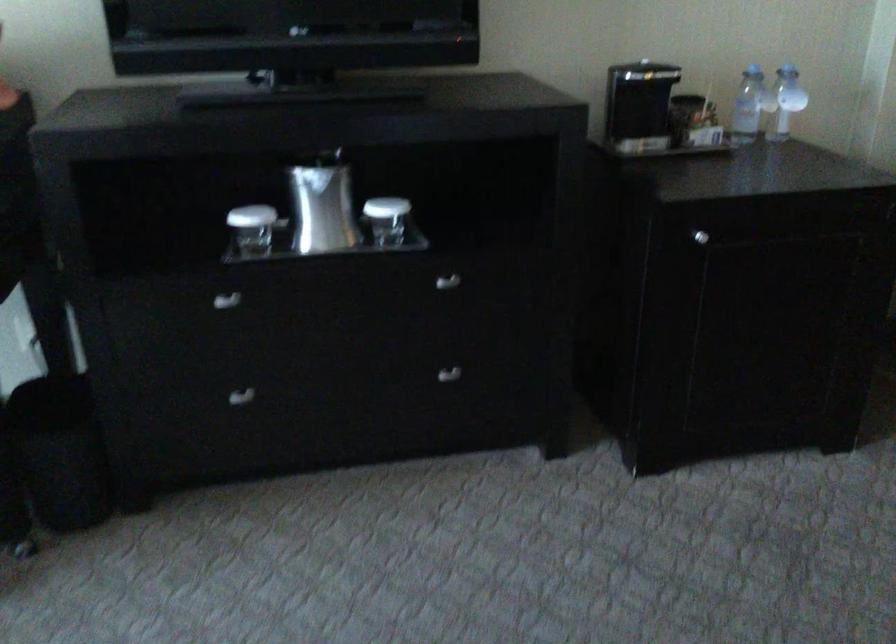
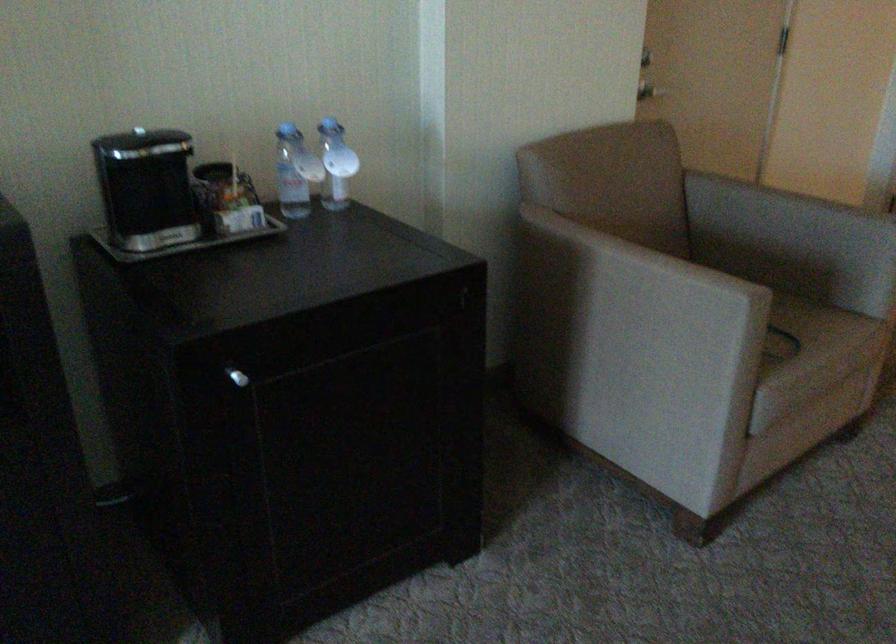
In the second image, find the point that corresponds to (694,230) in the first image.

(237, 377)